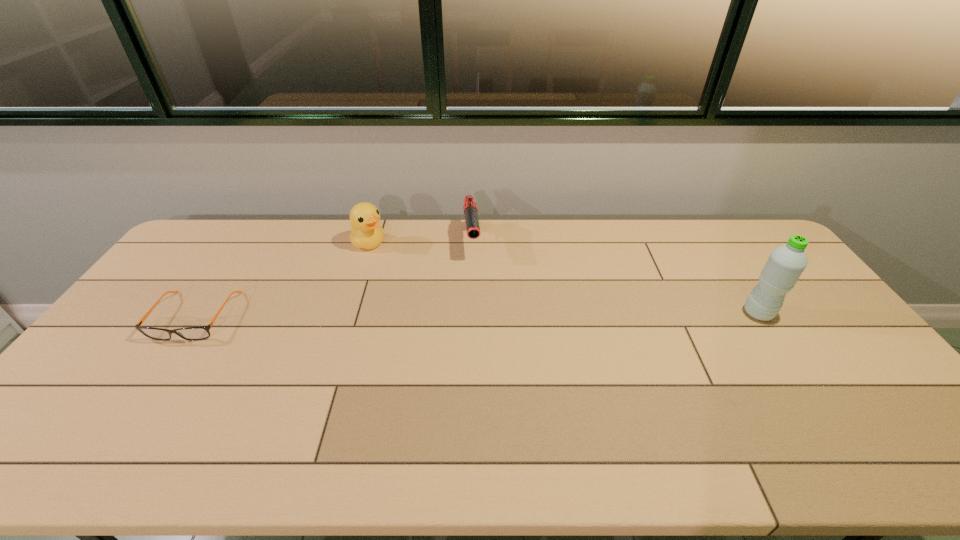
Identify the location of vacant space situated 0.360m on the face of the third object from right to left. (446, 300).

What are the coordinates of `free space located 0.050m at the aiming end of the third object from left to right` in the screenshot? It's located at (473, 273).

Where is `free space located at the aiming end of the third object from left to right`? free space located at the aiming end of the third object from left to right is located at coordinates (479, 321).

This screenshot has width=960, height=540. I want to click on vacant space positioned 0.220m at the aiming end of the third object from left to right, so click(478, 309).

Identify the location of duck located in the far edge section of the desktop. (366, 233).

You are a GUI agent. You are given a task and a screenshot of the screen. Output one action in this format:
    pyautogui.click(x=<x>, y=<y>)
    Task: Click on the gun that is at the far edge
    This screenshot has height=540, width=960.
    Given the screenshot: What is the action you would take?
    pyautogui.click(x=470, y=207)

The height and width of the screenshot is (540, 960). I want to click on object that is at the left edge, so click(190, 333).

In the image, there is a desktop. Where is `vacant space at the far edge`? The image size is (960, 540). vacant space at the far edge is located at coordinates (718, 259).

This screenshot has height=540, width=960. In the image, there is a desktop. What are the coordinates of `vacant space at the near edge` in the screenshot? It's located at (807, 396).

Where is `vacant region at the far right corner of the desktop`? The image size is (960, 540). vacant region at the far right corner of the desktop is located at coordinates (712, 221).